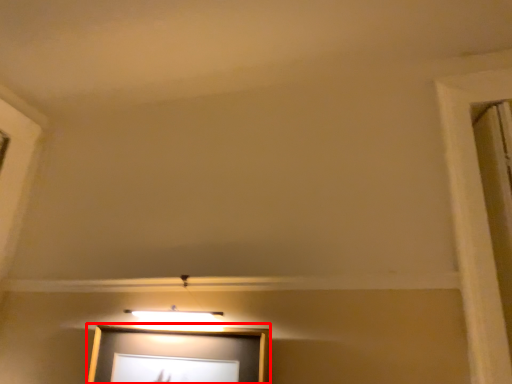
Question: Where is picture frame (annotated by the red box) located in relation to window frame in the image?

Choices:
 (A) right
 (B) left

Answer: (B)